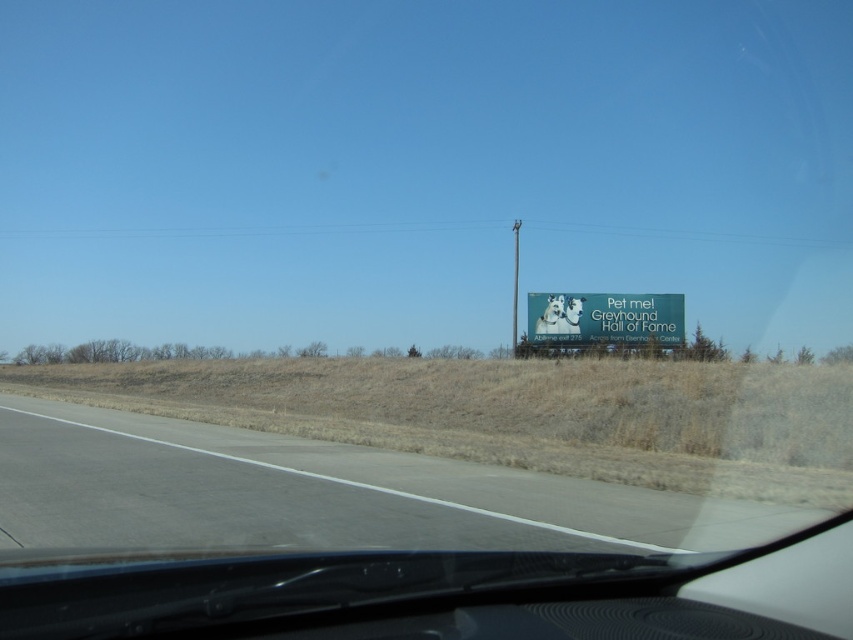
Which is above, gray asphalt road at lower left or white glossy billboard at right?

white glossy billboard at right is above.

Which is in front, point (527, 545) or point (666, 342)?

Point (527, 545) is in front.

Identify the location of gray asphalt road at lower left. (322, 493).